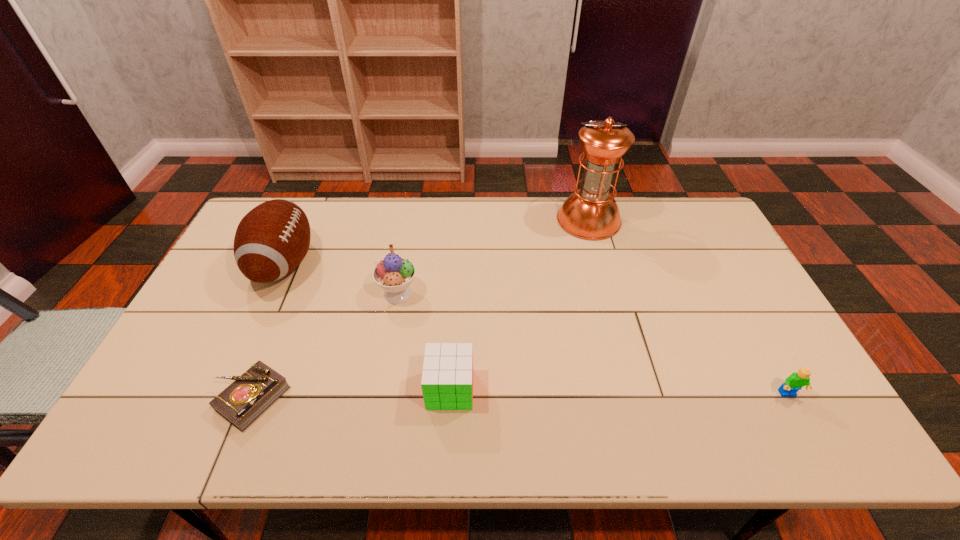
Find the location of `vacant point at the near edge`. vacant point at the near edge is located at coordinates (697, 415).

Locate an element on the screen. The width and height of the screenshot is (960, 540). vacant space at the left edge of the desktop is located at coordinates (204, 373).

The width and height of the screenshot is (960, 540). What are the coordinates of `vacant area at the right edge` in the screenshot? It's located at (733, 326).

This screenshot has width=960, height=540. Find the location of `vacant space at the far right corner of the desktop`. vacant space at the far right corner of the desktop is located at coordinates (685, 202).

You are a GUI agent. You are given a task and a screenshot of the screen. Output one action in this format:
    pyautogui.click(x=<x>, y=<y>)
    Task: Click on the free area in between the football and the Lego
    The height and width of the screenshot is (540, 960).
    Given the screenshot: What is the action you would take?
    pyautogui.click(x=536, y=329)

The width and height of the screenshot is (960, 540). Find the location of `free space between the fifth shortest object and the oil lamp`. free space between the fifth shortest object and the oil lamp is located at coordinates (436, 242).

Identify the location of free space between the third tallest object and the fifth object from left to right. This screenshot has width=960, height=540. (493, 256).

Where is `vacant region between the shortest object and the rightmost object`? This screenshot has height=540, width=960. vacant region between the shortest object and the rightmost object is located at coordinates (519, 396).

Identify the location of empty space between the football and the diary. This screenshot has width=960, height=540. (268, 331).

You are a GUI agent. You are given a task and a screenshot of the screen. Output one action in this format:
    pyautogui.click(x=<x>, y=<y>)
    Task: Click on the free space between the third object from left to right and the oil lamp
    This screenshot has height=540, width=960.
    Given the screenshot: What is the action you would take?
    pyautogui.click(x=493, y=256)